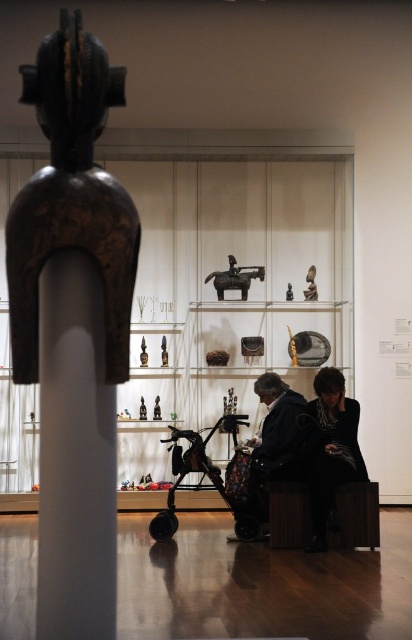
Can you confirm if white glossy pillar at center is smaller than brown polished wood horse at center?

Correct, white glossy pillar at center occupies less space than brown polished wood horse at center.

Does point (70, 452) come closer to viewer compared to point (248, 284)?

Yes, point (70, 452) is closer to viewer.

In order to click on white glossy pillar at center in this screenshot , I will do `click(74, 456)`.

Can you confirm if black polished wood figure at center is positioned to the right of white glossy pillar at center?

Indeed, black polished wood figure at center is positioned on the right side of white glossy pillar at center.

Which is above, black polished wood figure at center or white glossy pillar at center?

Positioned higher is black polished wood figure at center.

Is point (112, 362) positioned behind point (42, 467)?

That is False.

At what (x,y) coordinates should I click in order to perform the action: click on black polished wood figure at center. Please return your answer as a coordinate pair (x, y). This screenshot has height=640, width=412. Looking at the image, I should click on point(74,326).

Who is shorter, black matte jacket at lower right or brown polished wood horse at center?

brown polished wood horse at center

Is black matte jacket at lower right taller than brown polished wood horse at center?

Indeed, black matte jacket at lower right has a greater height compared to brown polished wood horse at center.

Is point (346, 428) behind point (250, 278)?

No, (346, 428) is closer to viewer.

Locate an element on the screen. The height and width of the screenshot is (640, 412). black matte jacket at lower right is located at coordinates (332, 449).